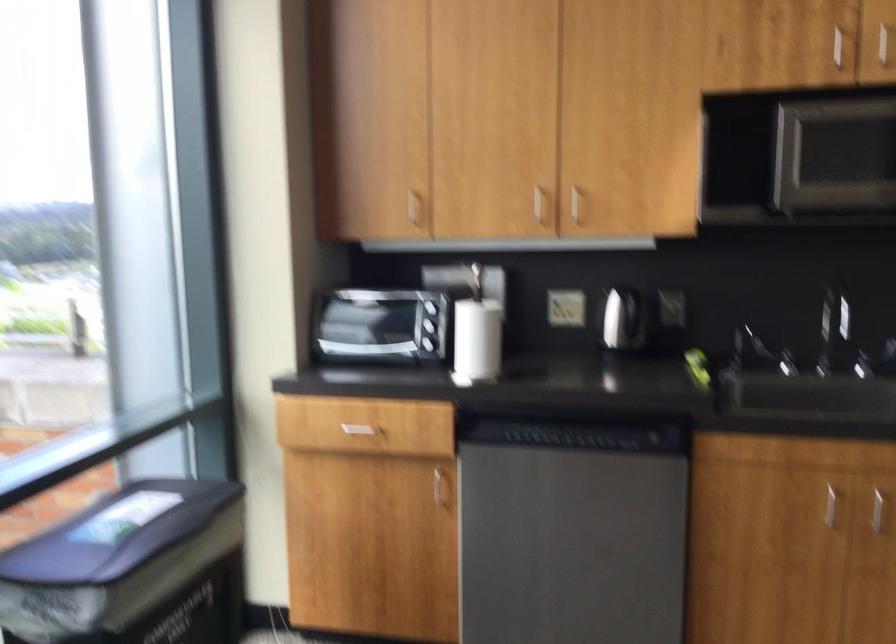
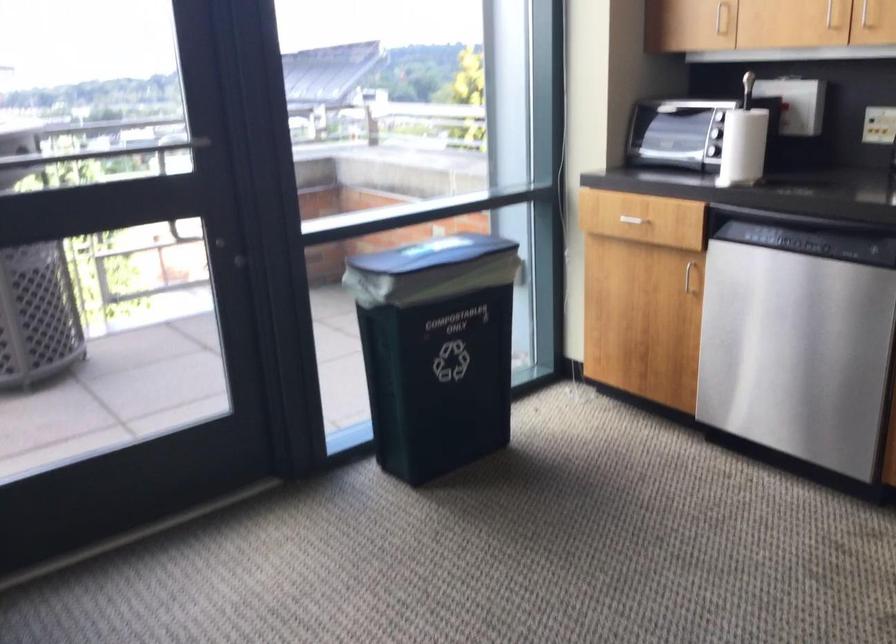
Where in the second image is the point corresponding to point 418,207 from the first image?

(721, 17)